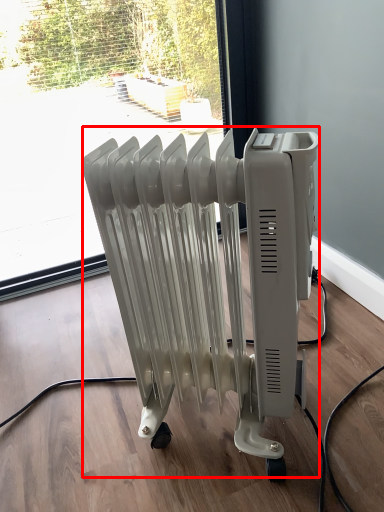
Question: From the image's perspective, what is the correct spatial relationship of bath heater (annotated by the red box) in relation to window?

Choices:
 (A) above
 (B) below

Answer: (B)